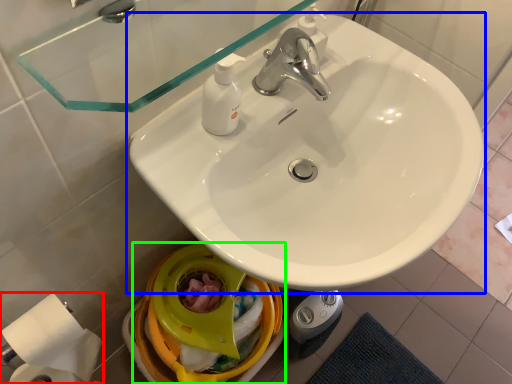
Question: Which object is the farthest from toilet paper (highlighted by a red box)? Choose among these: sink (highlighted by a blue box) or bidet (highlighted by a green box).

Choices:
 (A) sink
 (B) bidet

Answer: (A)